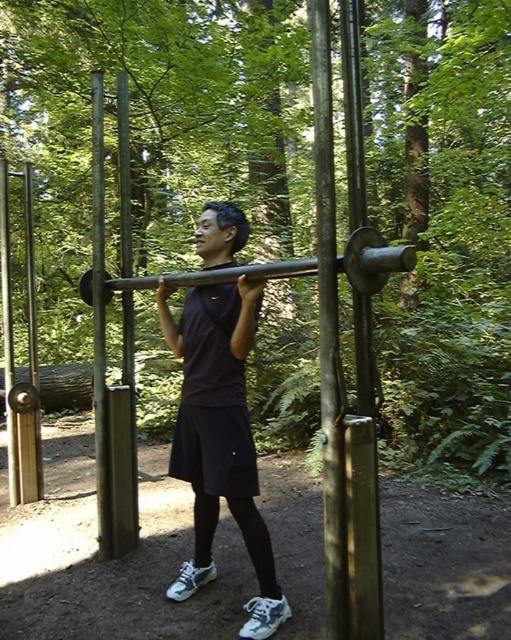
Image resolution: width=511 pixels, height=640 pixels. What are the coordinates of `dark purple shirt at center` in the screenshot? It's located at (220, 438).

Which is behind, point (208, 394) or point (125, 288)?

Point (125, 288)

You are a GUI agent. You are given a task and a screenshot of the screen. Output one action in this format:
    pyautogui.click(x=<x>, y=<y>)
    Task: Click on the dark purple shirt at center
    This screenshot has height=640, width=511.
    Given the screenshot: What is the action you would take?
    pyautogui.click(x=220, y=438)

Does dark purple shirt at center have a larger size compared to black metallic barbell at center?

Yes, dark purple shirt at center is bigger than black metallic barbell at center.

Does dark purple shirt at center have a greater width compared to black metallic barbell at center?

In fact, dark purple shirt at center might be narrower than black metallic barbell at center.

Is point (224, 424) farther from camera compared to point (88, 292)?

No.

Find the location of a particular element. The height and width of the screenshot is (640, 511). dark purple shirt at center is located at coordinates (220, 438).

Does black metallic barbell at center appear over metallic silver pole at center?

Correct, black metallic barbell at center is located above metallic silver pole at center.

Does black metallic barbell at center appear on the right side of metallic silver pole at center?

Yes, black metallic barbell at center is to the right of metallic silver pole at center.

Between point (87, 296) and point (132, 342), which one is positioned behind?

The point (87, 296) is behind.

Locate an element on the screen. This screenshot has height=640, width=511. black metallic barbell at center is located at coordinates (373, 259).